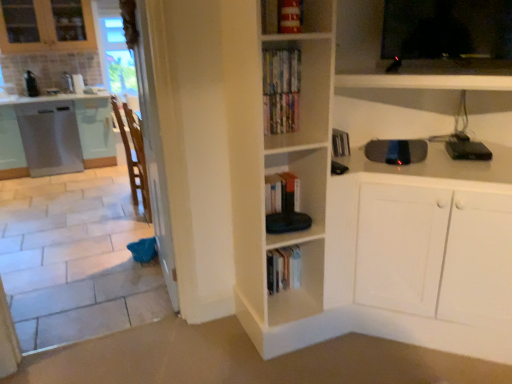
Where is `vacant space in front of transparent plastic screen door at left`? This screenshot has height=384, width=512. vacant space in front of transparent plastic screen door at left is located at coordinates (123, 312).